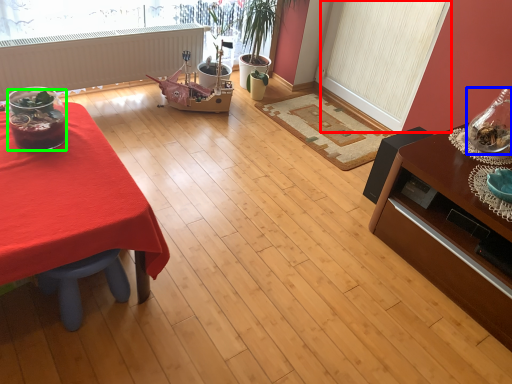
Question: Estimate the real-world distances between objects in this image. Which object is farther from screen door (highlighted by a red box), glass vase (highlighted by a blue box) or food (highlighted by a green box)?

Choices:
 (A) glass vase
 (B) food

Answer: (B)